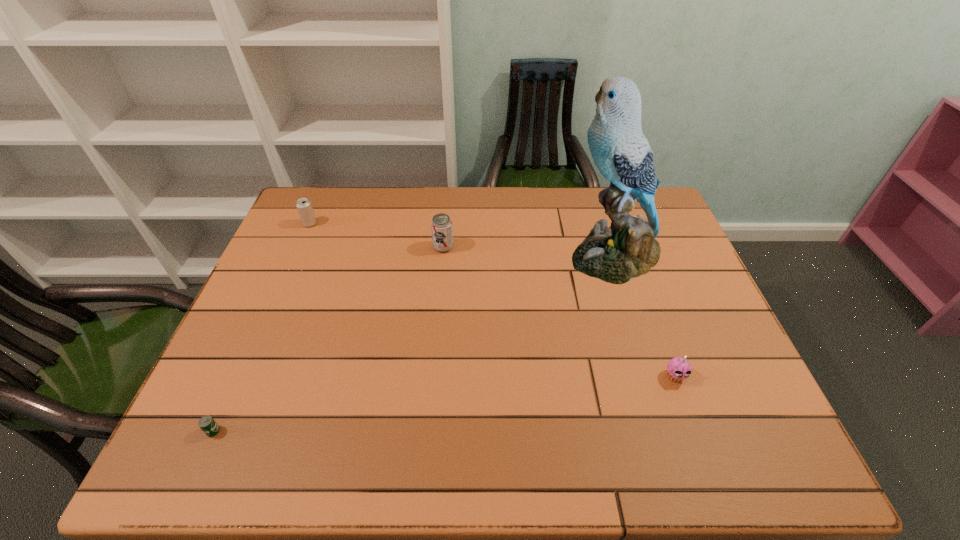
Find the location of `parakeet`. parakeet is located at coordinates (627, 249).

Where is `the second tallest object`? The height and width of the screenshot is (540, 960). the second tallest object is located at coordinates (441, 225).

You are a GUI agent. You are given a task and a screenshot of the screen. Output one action in this format:
    pyautogui.click(x=<x>, y=<y>)
    Task: Click on the third object from right to left
    This screenshot has width=960, height=540.
    Given the screenshot: What is the action you would take?
    pyautogui.click(x=441, y=225)

What are the coordinates of `the farthest object` in the screenshot? It's located at (303, 205).

This screenshot has height=540, width=960. Find the location of `the second tallest beer can`. the second tallest beer can is located at coordinates (303, 205).

Where is `cupcake`? The image size is (960, 540). cupcake is located at coordinates (678, 369).

You are a GUI agent. You are given a task and a screenshot of the screen. Output one action in this format:
    pyautogui.click(x=<x>, y=<y>)
    Task: Click on the nearest object
    This screenshot has height=540, width=960.
    Given the screenshot: What is the action you would take?
    pyautogui.click(x=207, y=424)

Identify the location of the shortest object. The height and width of the screenshot is (540, 960). (207, 424).

Where is `free space located 0.270m on the face of the parakeet`? The width and height of the screenshot is (960, 540). free space located 0.270m on the face of the parakeet is located at coordinates (473, 255).

Where is `free space located on the face of the parakeet`? The width and height of the screenshot is (960, 540). free space located on the face of the parakeet is located at coordinates (477, 255).